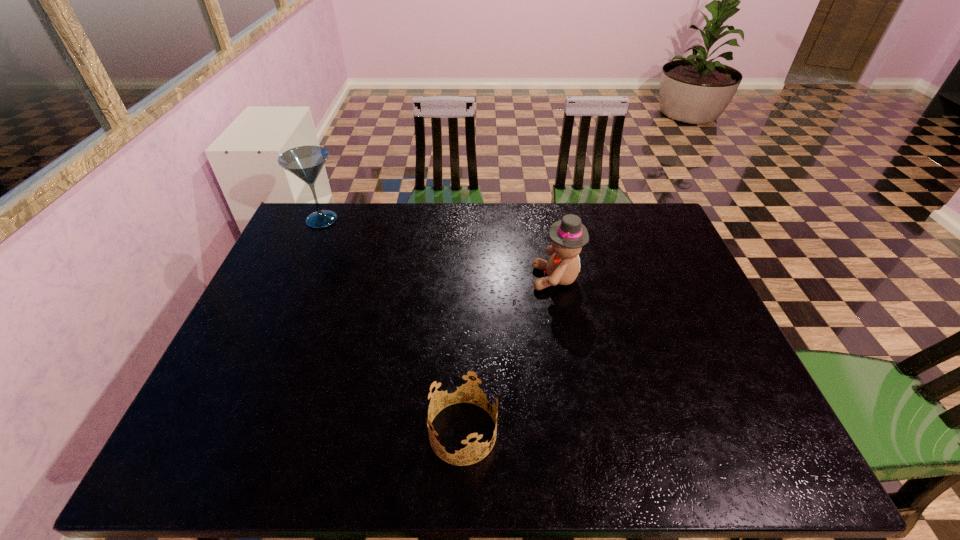
What are the coordinates of `vacant space in between the crown and the rightmost object` in the screenshot? It's located at (510, 355).

The height and width of the screenshot is (540, 960). Find the location of `blank region between the second nearest object and the leftmost object`. blank region between the second nearest object and the leftmost object is located at coordinates (439, 249).

Identify the location of free space between the leftmost object and the rightmost object. (439, 249).

What are the coordinates of `free area in between the martini and the second object from left to right` in the screenshot? It's located at (393, 326).

This screenshot has height=540, width=960. In order to click on free space between the leftmost object and the nearest object in this screenshot , I will do `click(393, 326)`.

Where is `free space that is in between the rightmost object and the leftmost object`? This screenshot has height=540, width=960. free space that is in between the rightmost object and the leftmost object is located at coordinates (439, 249).

This screenshot has width=960, height=540. I want to click on free space that is in between the rag_doll and the crown, so click(510, 355).

The height and width of the screenshot is (540, 960). What are the coordinates of `free spot between the crown and the leftmost object` in the screenshot? It's located at (393, 326).

Find the location of a particular element. free area in between the shortest object and the rightmost object is located at coordinates pos(510,355).

This screenshot has width=960, height=540. I want to click on object that is the closest to the nearest object, so click(568, 236).